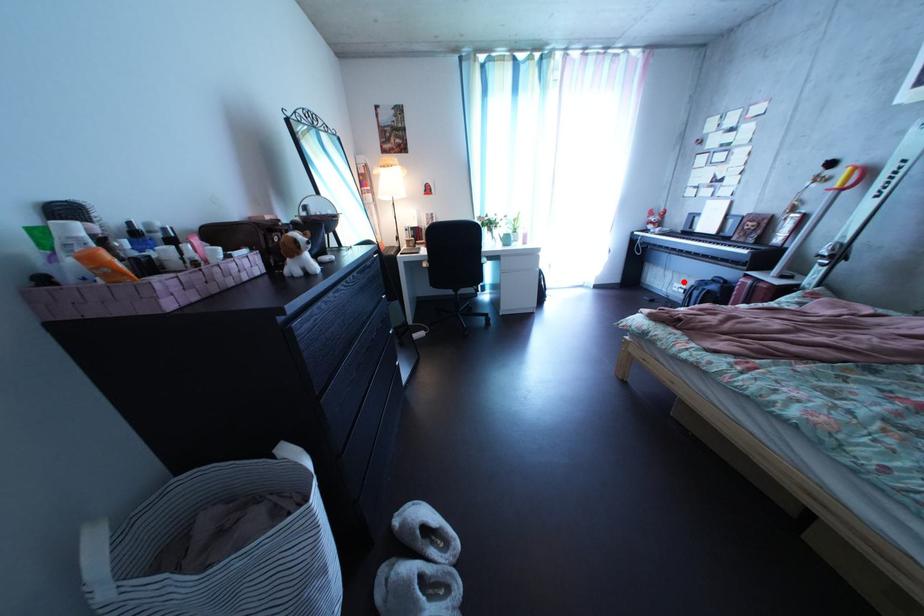
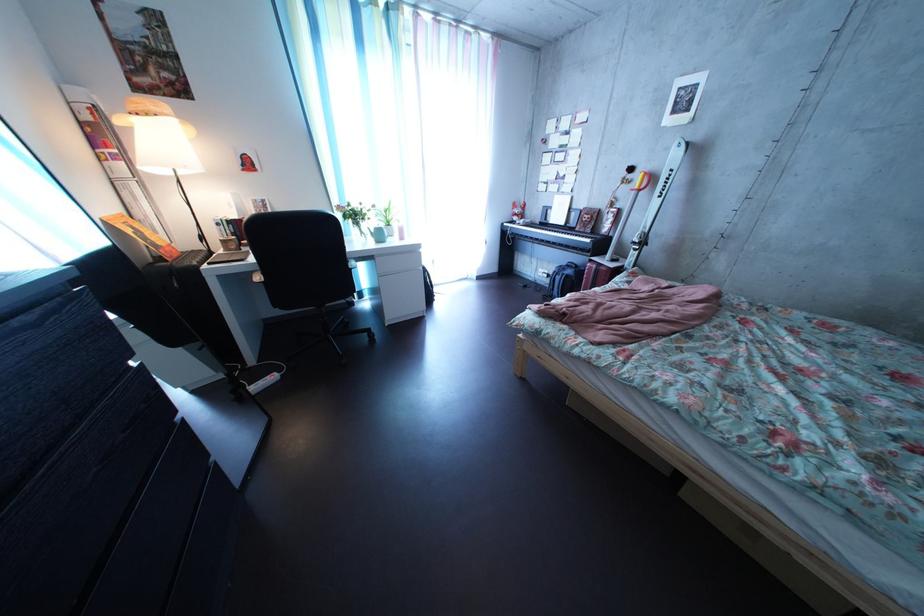
Question: I am providing you with two images of the same scene from different viewpoints. A red point is shown in image1. For the corresponding object point in image2, is it positioned nearer or farther from the camera?

Choices:
 (A) Nearer
 (B) Farther

Answer: (B)